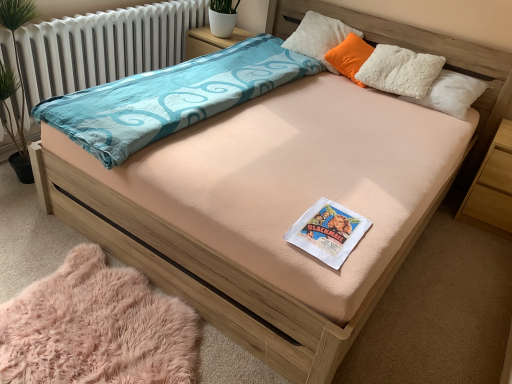
Question: Can you confirm if white paper book at center is wider than pink fluffy rug at lower left?

Choices:
 (A) yes
 (B) no

Answer: (B)

Question: Are white paper book at center and pink fluffy rug at lower left located far from each other?

Choices:
 (A) no
 (B) yes

Answer: (A)

Question: Is the depth of white paper book at center greater than that of pink fluffy rug at lower left?

Choices:
 (A) no
 (B) yes

Answer: (B)

Question: Can you confirm if white paper book at center is shorter than pink fluffy rug at lower left?

Choices:
 (A) no
 (B) yes

Answer: (A)

Question: From the image's perspective, is white paper book at center beneath pink fluffy rug at lower left?

Choices:
 (A) no
 (B) yes

Answer: (A)

Question: From a real-world perspective, is orange soft pillow at upper right, the 2th pillow from the top, positioned above or below light brown wood at right?

Choices:
 (A) below
 (B) above

Answer: (B)

Question: From the image's perspective, relative to light brown wood at right, is orange soft pillow at upper right, which appears as the first pillow when ordered from the bottom, above or below?

Choices:
 (A) above
 (B) below

Answer: (A)

Question: In terms of height, does orange soft pillow at upper right, which appears as the first pillow when ordered from the bottom, look taller or shorter compared to light brown wood at right?

Choices:
 (A) short
 (B) tall

Answer: (A)

Question: Does point (356, 39) appear closer or farther from the camera than point (464, 215)?

Choices:
 (A) closer
 (B) farther

Answer: (B)

Question: From the image's perspective, is white fluffy pillow at upper right, which appears as the first pillow when viewed from the top, located above or below orange soft pillow at upper right, the 2th pillow from the top?

Choices:
 (A) above
 (B) below

Answer: (A)

Question: Does point (296, 39) appear closer or farther from the camera than point (348, 71)?

Choices:
 (A) closer
 (B) farther

Answer: (B)

Question: Choose the correct answer: Is white fluffy pillow at upper right, which appears as the first pillow when viewed from the top, inside orange soft pillow at upper right, the 2th pillow from the top, or outside it?

Choices:
 (A) inside
 (B) outside

Answer: (B)

Question: Is white fluffy pillow at upper right, which is the second pillow in bottom-to-top order, in front of or behind orange soft pillow at upper right, the 2th pillow from the top, in the image?

Choices:
 (A) front
 (B) behind

Answer: (A)

Question: From a real-world perspective, is light brown wood at right above or below white fluffy pillow at upper right, which is the second pillow in bottom-to-top order?

Choices:
 (A) above
 (B) below

Answer: (B)

Question: Looking at their shapes, would you say light brown wood at right is wider or thinner than white fluffy pillow at upper right, which is the second pillow in bottom-to-top order?

Choices:
 (A) wide
 (B) thin

Answer: (A)